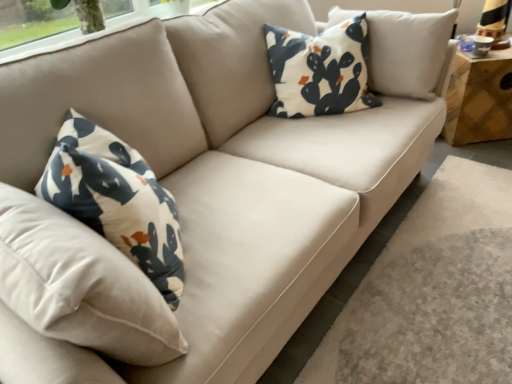
What do you see at coordinates (319, 70) in the screenshot?
I see `white fabric pillow with cactus print at upper center` at bounding box center [319, 70].

In order to face white fabric pillow with cactus print at upper center, should I rotate leftwards or rightwards?

Rotate your view right by about 9.069°.

This screenshot has height=384, width=512. Find the location of `white fabric pillow with cactus print at upper center`. white fabric pillow with cactus print at upper center is located at coordinates (319, 70).

Describe the element at coordinates (479, 98) in the screenshot. The height and width of the screenshot is (384, 512). I see `wooden side table at right` at that location.

In order to click on wooden side table at right in this screenshot , I will do `click(479, 98)`.

The width and height of the screenshot is (512, 384). What are the coordinates of `white fabric pillow with cactus print at upper center` in the screenshot? It's located at (319, 70).

Between white fabric pillow with cactus print at upper center and wooden side table at right, which one appears on the left side from the viewer's perspective?

Positioned to the left is white fabric pillow with cactus print at upper center.

Is white fabric pillow with cactus print at upper center behind wooden side table at right?

No, it is in front of wooden side table at right.

Is point (362, 40) closer or farther from the camera than point (456, 119)?

Point (362, 40).

From the image's perspective, is white fabric pillow with cactus print at upper center located beneath wooden side table at right?

Indeed, from the image's perspective, white fabric pillow with cactus print at upper center is shown beneath wooden side table at right.

In the scene shown: From a real-world perspective, does white fabric pillow with cactus print at upper center sit lower than wooden side table at right?

Incorrect, from a real-world perspective, white fabric pillow with cactus print at upper center is higher than wooden side table at right.

Which object is thinner, white fabric pillow with cactus print at upper center or wooden side table at right?

white fabric pillow with cactus print at upper center is thinner.

Considering the relative sizes of white fabric pillow with cactus print at upper center and wooden side table at right in the image provided, is white fabric pillow with cactus print at upper center taller than wooden side table at right?

Correct, white fabric pillow with cactus print at upper center is much taller as wooden side table at right.

Considering the sizes of objects white fabric pillow with cactus print at upper center and wooden side table at right in the image provided, who is bigger, white fabric pillow with cactus print at upper center or wooden side table at right?

wooden side table at right is bigger.

Which is correct: white fabric pillow with cactus print at upper center is inside wooden side table at right, or outside of it?

white fabric pillow with cactus print at upper center exists outside the volume of wooden side table at right.

Is white fabric pillow with cactus print at upper center positioned far away from wooden side table at right?

Actually, white fabric pillow with cactus print at upper center and wooden side table at right are a little close together.

Consider the image. Does white fabric pillow with cactus print at upper center turn towards wooden side table at right?

No, white fabric pillow with cactus print at upper center does not turn towards wooden side table at right.

Could you measure the distance between white fabric pillow with cactus print at upper center and wooden side table at right?

white fabric pillow with cactus print at upper center and wooden side table at right are 32.85 inches apart.

This screenshot has height=384, width=512. Find the location of `table that is on the right side of white fabric pillow with cactus print at upper center`. table that is on the right side of white fabric pillow with cactus print at upper center is located at coordinates (479, 98).

Considering the relative positions of wooden side table at right and white fabric pillow with cactus print at upper center in the image provided, is wooden side table at right to the left of white fabric pillow with cactus print at upper center from the viewer's perspective?

In fact, wooden side table at right is to the right of white fabric pillow with cactus print at upper center.

Which object is further away from the camera taking this photo, wooden side table at right or white fabric pillow with cactus print at upper center?

wooden side table at right is behind.

Is point (466, 91) closer to camera compared to point (349, 102)?

No, (466, 91) is behind (349, 102).

From the image's perspective, which is below, wooden side table at right or white fabric pillow with cactus print at upper center?

white fabric pillow with cactus print at upper center appears lower in the image.

From a real-world perspective, is wooden side table at right physically above white fabric pillow with cactus print at upper center?

Actually, wooden side table at right is physically below white fabric pillow with cactus print at upper center in the real world.

Does wooden side table at right have a lesser width compared to white fabric pillow with cactus print at upper center?

No, wooden side table at right is not thinner than white fabric pillow with cactus print at upper center.

Between wooden side table at right and white fabric pillow with cactus print at upper center, which one has more height?

Standing taller between the two is white fabric pillow with cactus print at upper center.

Who is smaller, wooden side table at right or white fabric pillow with cactus print at upper center?

Smaller between the two is white fabric pillow with cactus print at upper center.

Is white fabric pillow with cactus print at upper center inside wooden side table at right?

No, wooden side table at right does not contain white fabric pillow with cactus print at upper center.

In the scene shown: Can you see wooden side table at right touching white fabric pillow with cactus print at upper center?

There is a gap between wooden side table at right and white fabric pillow with cactus print at upper center.

Is wooden side table at right positioned with its back to white fabric pillow with cactus print at upper center?

No.

How distant is wooden side table at right from white fabric pillow with cactus print at upper center?

wooden side table at right and white fabric pillow with cactus print at upper center are 32.85 inches apart.

Locate an element on the screen. table directly beneath the white fabric pillow with cactus print at upper center (from a real-world perspective) is located at coordinates (479, 98).

Find the location of a particular element. Image resolution: width=512 pixels, height=384 pixels. table on the right of white fabric pillow with cactus print at upper center is located at coordinates (479, 98).

Identify the location of pillow located below the wooden side table at right (from the image's perspective). This screenshot has height=384, width=512. (319, 70).